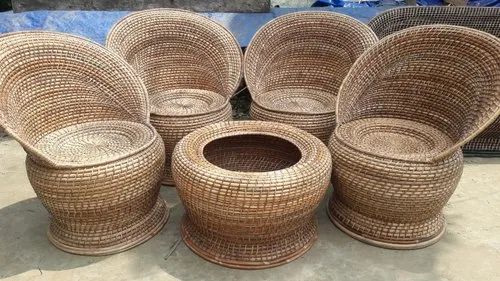
Where is `rightmost chair back`? The width and height of the screenshot is (500, 281). rightmost chair back is located at coordinates (431, 82).